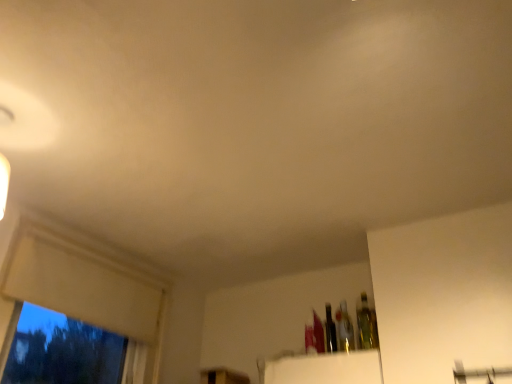
Question: From the image's perspective, is translucent glass bottle at upper right, the 3th bottle in the left-to-right sequence, on white matte window frame at left?

Choices:
 (A) no
 (B) yes

Answer: (B)

Question: Is translucent glass bottle at upper right, which ranks as the 1th bottle in right-to-left order, placed right next to white matte window frame at left?

Choices:
 (A) no
 (B) yes

Answer: (A)

Question: Does translucent glass bottle at upper right, the 3th bottle in the left-to-right sequence, come behind white matte window frame at left?

Choices:
 (A) yes
 (B) no

Answer: (A)

Question: Considering the relative positions of translucent glass bottle at upper right, the 3th bottle in the left-to-right sequence, and white matte window frame at left in the image provided, is translucent glass bottle at upper right, the 3th bottle in the left-to-right sequence, to the left of white matte window frame at left from the viewer's perspective?

Choices:
 (A) yes
 (B) no

Answer: (B)

Question: Is translucent glass bottle at upper right, the 3th bottle in the left-to-right sequence, surrounding white matte window frame at left?

Choices:
 (A) no
 (B) yes

Answer: (A)

Question: From the image's perspective, is translucent glass bottle at upper right, which ranks as the 1th bottle in right-to-left order, above or below translucent glass bottle at center, which is counted as the second bottle, starting from the left?

Choices:
 (A) below
 (B) above

Answer: (B)

Question: From their relative heights in the image, would you say translucent glass bottle at upper right, the 3th bottle in the left-to-right sequence, is taller or shorter than translucent glass bottle at center, which is counted as the second bottle, starting from the left?

Choices:
 (A) short
 (B) tall

Answer: (A)

Question: Based on their sizes in the image, would you say translucent glass bottle at upper right, which ranks as the 1th bottle in right-to-left order, is bigger or smaller than translucent glass bottle at center, which is counted as the second bottle, starting from the left?

Choices:
 (A) big
 (B) small

Answer: (A)

Question: Is translucent glass bottle at upper right, which ranks as the 1th bottle in right-to-left order, inside the boundaries of translucent glass bottle at center, which is counted as the second bottle, starting from the left, or outside?

Choices:
 (A) outside
 (B) inside

Answer: (A)

Question: Based on their sizes in the image, would you say shiny metallic bottle at upper right, placed as the 3th bottle when sorted from right to left, is bigger or smaller than translucent glass bottle at upper right, the 3th bottle in the left-to-right sequence?

Choices:
 (A) small
 (B) big

Answer: (A)

Question: From a real-world perspective, is shiny metallic bottle at upper right, the first bottle from the left, physically located above or below translucent glass bottle at upper right, which ranks as the 1th bottle in right-to-left order?

Choices:
 (A) below
 (B) above

Answer: (B)

Question: Looking at their shapes, would you say shiny metallic bottle at upper right, placed as the 3th bottle when sorted from right to left, is wider or thinner than translucent glass bottle at upper right, the 3th bottle in the left-to-right sequence?

Choices:
 (A) thin
 (B) wide

Answer: (A)

Question: Based on their positions, is shiny metallic bottle at upper right, the first bottle from the left, located to the left or right of translucent glass bottle at upper right, which ranks as the 1th bottle in right-to-left order?

Choices:
 (A) right
 (B) left

Answer: (B)

Question: Would you say translucent glass bottle at upper right, the 3th bottle in the left-to-right sequence, is to the left or to the right of white matte window frame at left in the picture?

Choices:
 (A) right
 (B) left

Answer: (A)

Question: In terms of height, does translucent glass bottle at upper right, which ranks as the 1th bottle in right-to-left order, look taller or shorter compared to white matte window frame at left?

Choices:
 (A) tall
 (B) short

Answer: (B)